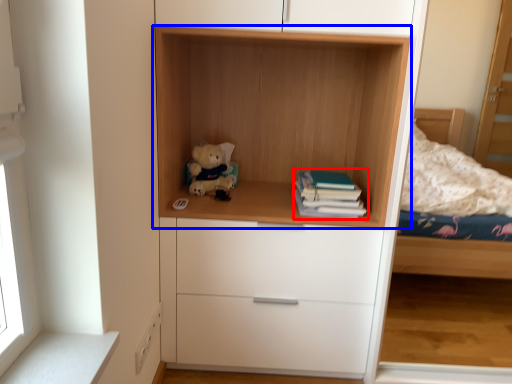
Question: Which point is closer to the camera, paperback book (highlighted by a red box) or shelf (highlighted by a blue box)?

Choices:
 (A) paperback book
 (B) shelf

Answer: (B)